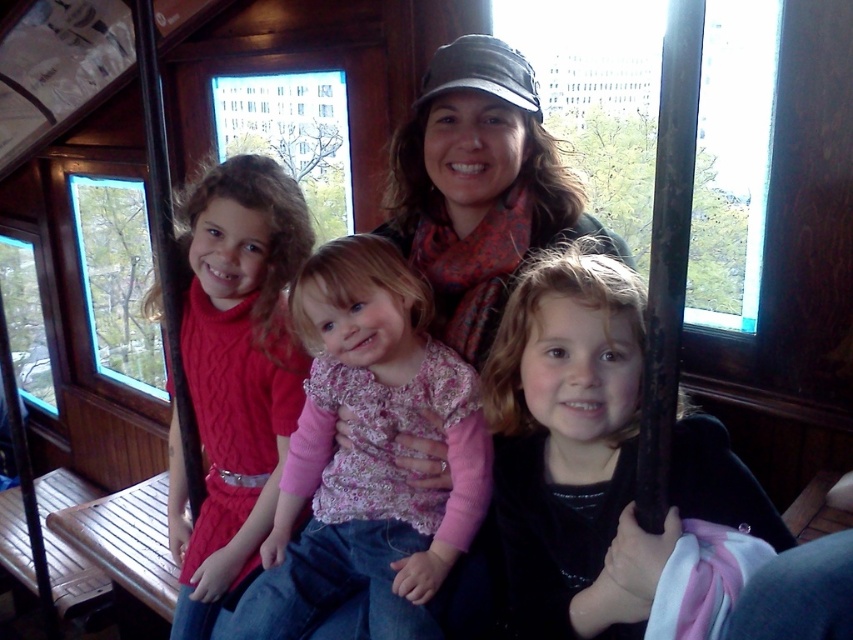
You are a photographer trying to capture the black velvet jacket at lower right and the pink textured sweater at center in a single shot. Which one of these items will appear closer to the camera in the photo?

The black velvet jacket at lower right is in front of the pink textured sweater at center, so it will appear closer to the camera in the photo.